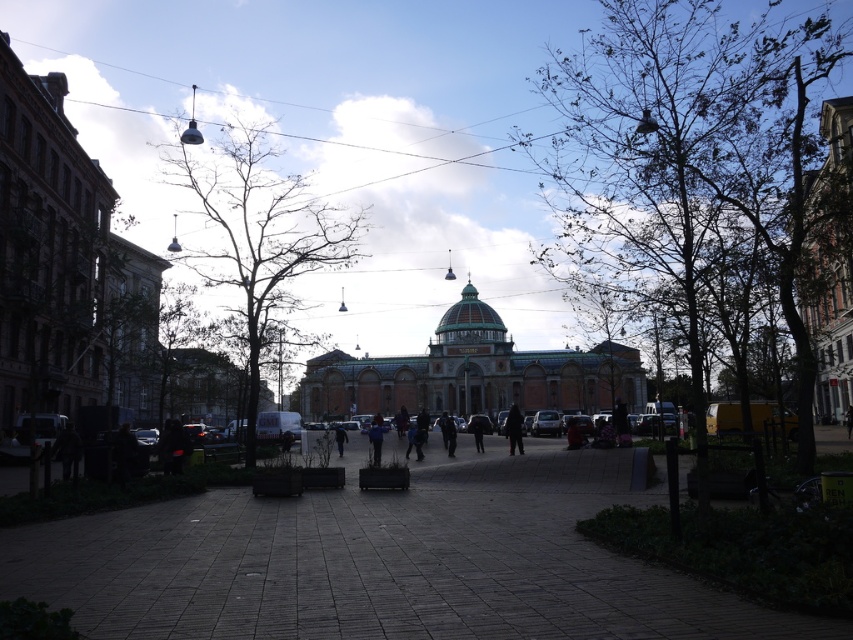
How far apart are brick pavement at center and bare branches at left?

A distance of 49.03 meters exists between brick pavement at center and bare branches at left.

What do you see at coordinates (384, 561) in the screenshot?
I see `brick pavement at center` at bounding box center [384, 561].

Where is `brick pavement at center`? brick pavement at center is located at coordinates (384, 561).

Between bare branches at left and dark blue jacket at center, which one appears on the right side from the viewer's perspective?

From the viewer's perspective, dark blue jacket at center appears more on the right side.

Can you confirm if bare branches at left is wider than dark blue jacket at center?

Yes.

I want to click on bare branches at left, so click(x=257, y=236).

Identify the location of bare branches at left. (257, 236).

Can you confirm if green leafy tree at center is smaller than bare branches at left?

Actually, green leafy tree at center might be larger than bare branches at left.

Describe the element at coordinates (688, 150) in the screenshot. I see `green leafy tree at center` at that location.

Locate an element on the screen. The width and height of the screenshot is (853, 640). green leafy tree at center is located at coordinates (688, 150).